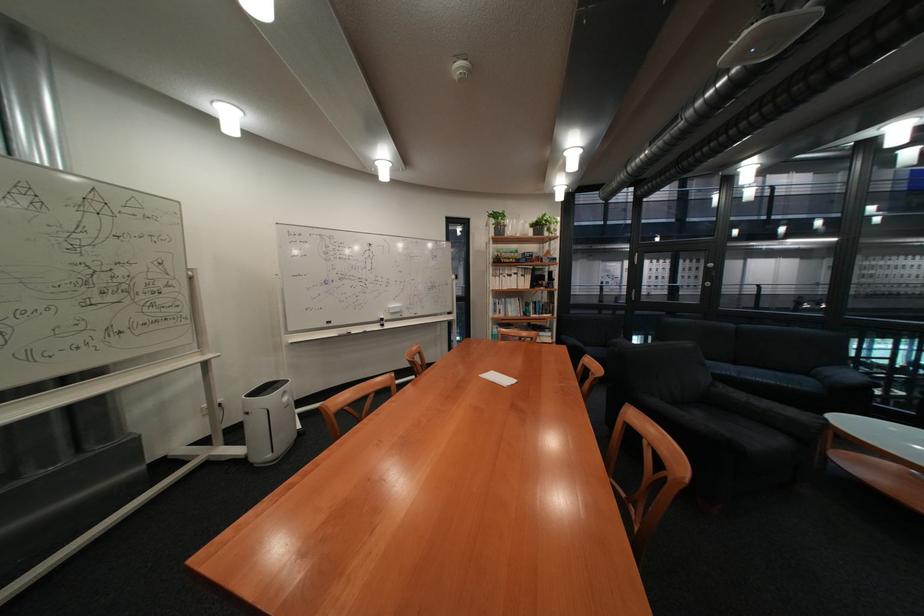
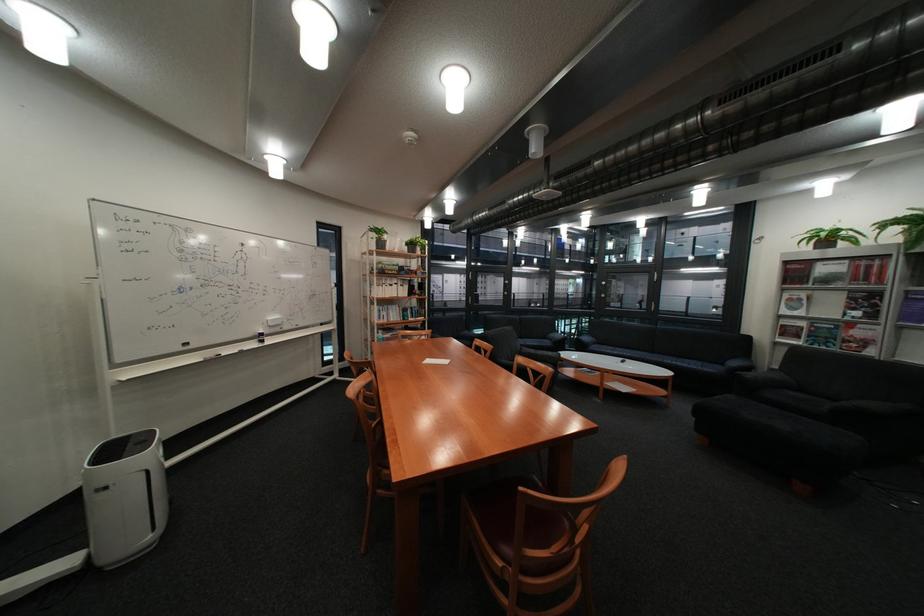
Locate, in the second image, the point that corresponds to (x=262, y=413) in the first image.

(120, 488)